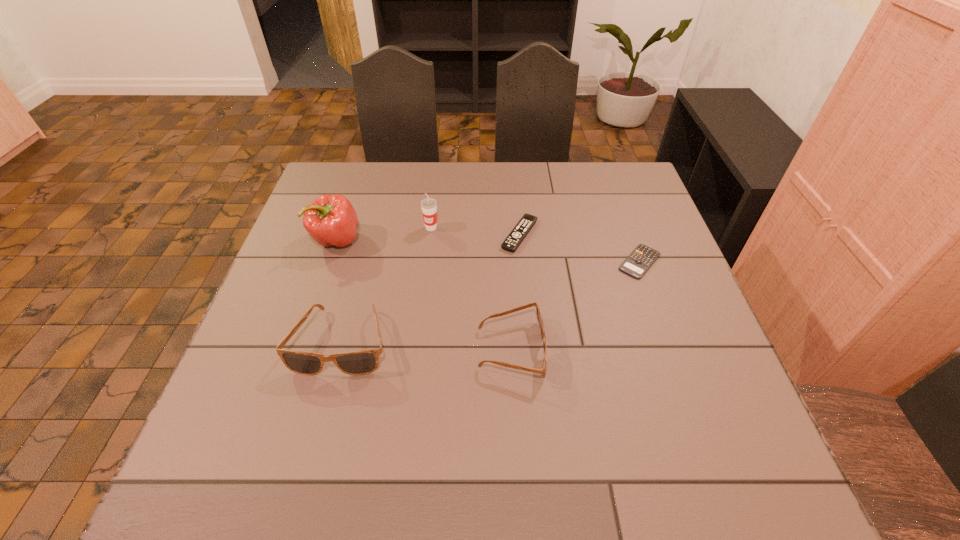
Please point out where to position a new sunglasses on the right to maintain spacing. Please provide its 2D coordinates. Your answer should be formatted as a tuple, i.e. [(x, y)], where the tuple contains the x and y coordinates of a point satisfying the conditions above.

[(685, 356)]